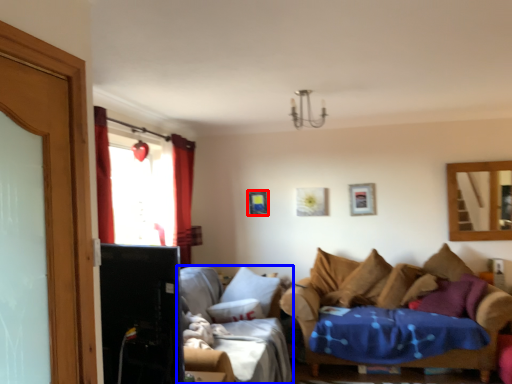
Question: Which of the following is the closest to the observer, picture frame (highlighted by a red box) or studio couch (highlighted by a blue box)?

Choices:
 (A) picture frame
 (B) studio couch

Answer: (B)